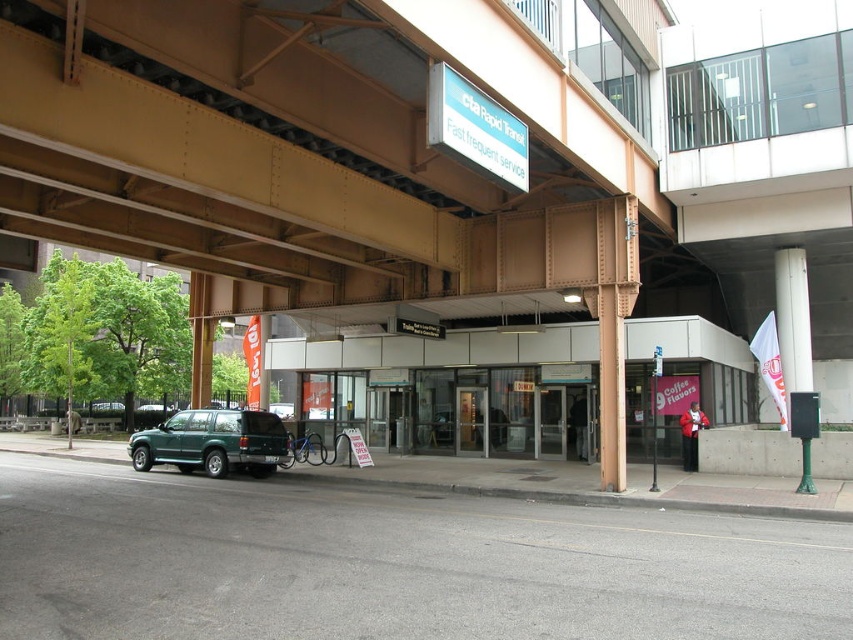
Who is shorter, metallic gray parking garage at center or green matte suv at lower left?

green matte suv at lower left

Which is more to the right, metallic gray parking garage at center or green matte suv at lower left?

metallic gray parking garage at center is more to the right.

Between point (340, 346) and point (225, 451), which one is positioned in front?

Point (225, 451) is more forward.

Where is `metallic gray parking garage at center`? The height and width of the screenshot is (640, 853). metallic gray parking garage at center is located at coordinates (450, 387).

Based on the photo, does metallic brown bridge at upper center appear on the left side of green matte suv at lower left?

Incorrect, metallic brown bridge at upper center is not on the left side of green matte suv at lower left.

From the picture: Is metallic brown bridge at upper center positioned before green matte suv at lower left?

That is True.

Which is in front, point (184, 241) or point (170, 458)?

Point (184, 241)

Locate an element on the screen. metallic brown bridge at upper center is located at coordinates (300, 150).

Is metallic brown bridge at upper center positioned at the back of metallic gray parking garage at center?

No, it is in front of metallic gray parking garage at center.

Is point (219, 19) farther from camera compared to point (733, 336)?

No, (219, 19) is closer to viewer.

Who is more distant from viewer, (244, 236) or (519, 376)?

The point (519, 376) is behind.

Image resolution: width=853 pixels, height=640 pixels. In order to click on metallic brown bridge at upper center in this screenshot , I will do `click(300, 150)`.